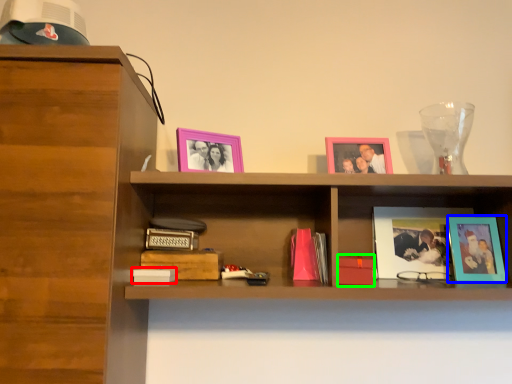
Question: Considering the real-world distances, which object is farthest from paperback book (highlighted by a red box)? picture frame (highlighted by a blue box) or paperback book (highlighted by a green box)?

Choices:
 (A) picture frame
 (B) paperback book

Answer: (A)